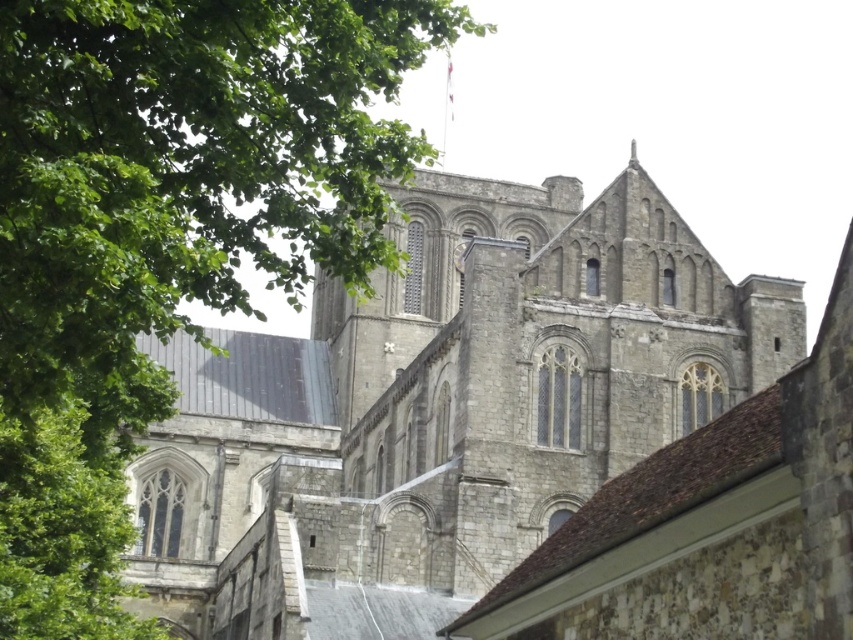
You are standing in a plaza and want to take a photo of the stone church at center. If your camera has a maximum focus range of 50 meters, will you need to move closer to capture the church clearly?

The stone church at center is 52.65 meters away from the camera. Since the camera can only focus up to 50 meters, you need to move closer to ensure the stone church at center is within the focus range.

You are standing in front of the historic stone building and want to walk from point A to point B. Point A is at coordinate point (639, 227) and point B is at coordinate point (102, 506). Considering the spatial relationship between these two points, which direction should you move to reach point B from point A?

To reach point B at coordinate point (102, 506) from point A at coordinate point (639, 227), you should move towards the lower right direction since point B is located at a lower y coordinate and higher x coordinate compared to point A.

You are standing in a historic town square and see the point marked at coordinate (x=440, y=410). What does this point indicate?

The point at coordinate (x=440, y=410) indicates the stone church at center.